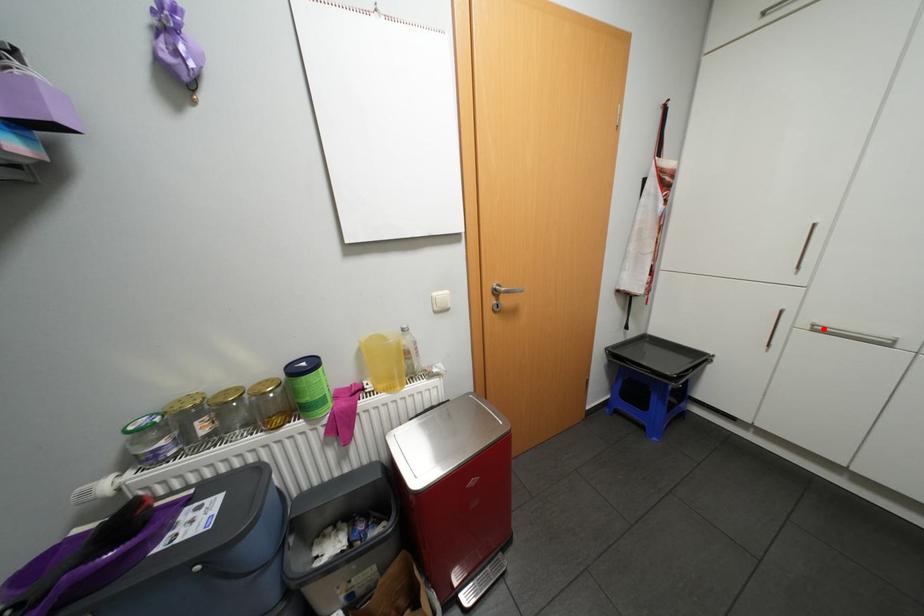
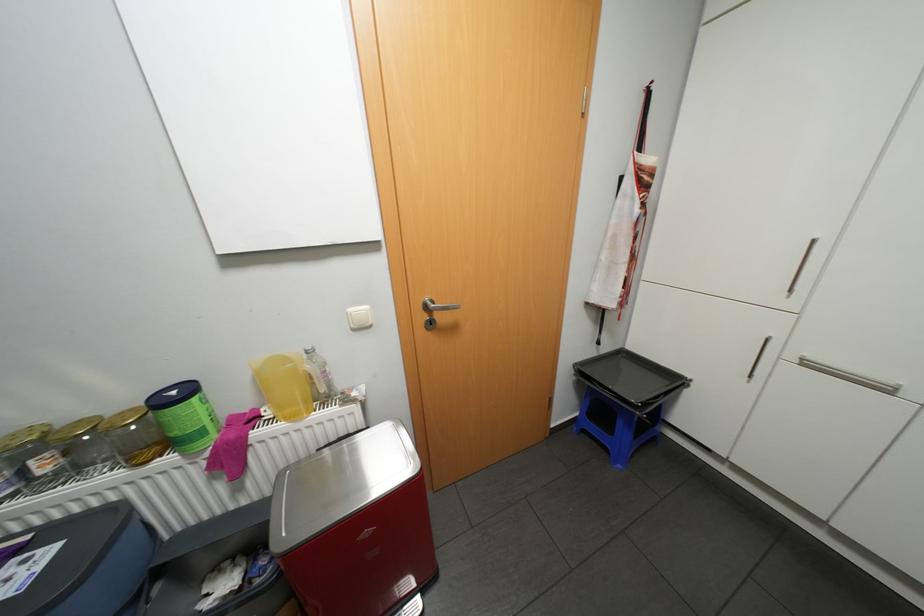
Where in the second image is the point corresponding to the highlighted location from the first image?

(813, 363)